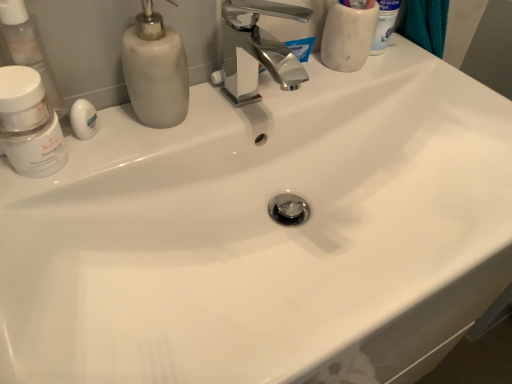
Where is `vacant space in front of transparent plastic container at left, which is the 1th toiletry from bottom to top`? vacant space in front of transparent plastic container at left, which is the 1th toiletry from bottom to top is located at coordinates (42, 227).